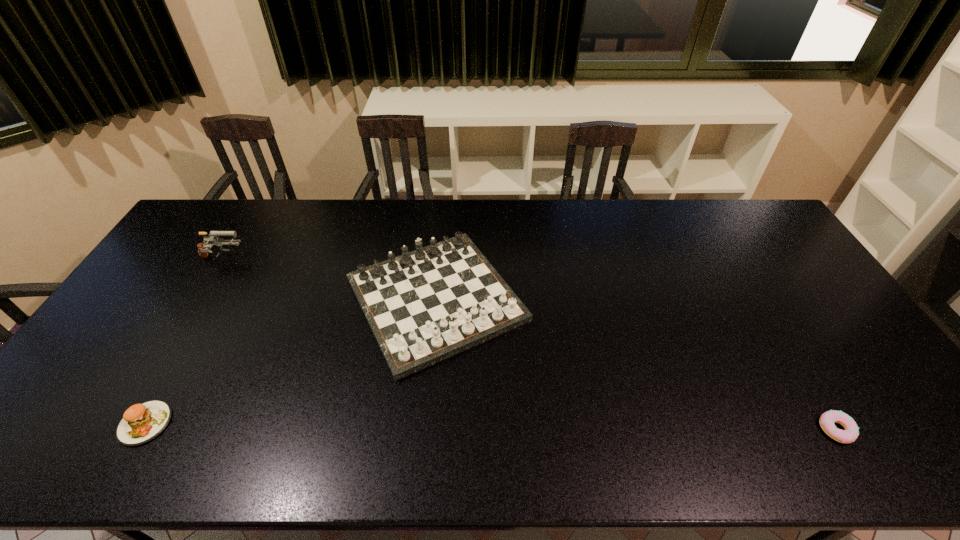
The width and height of the screenshot is (960, 540). What are the coordinates of `vacant space in between the doughnut and the gun` in the screenshot? It's located at (529, 345).

This screenshot has height=540, width=960. I want to click on vacant area that lies between the second object from right to left and the gun, so (x=329, y=279).

Locate an element on the screen. free spot between the patty and the gun is located at coordinates point(184,341).

Where is `vacant area that lies between the chessboard and the gun`? Image resolution: width=960 pixels, height=540 pixels. vacant area that lies between the chessboard and the gun is located at coordinates (329, 279).

Image resolution: width=960 pixels, height=540 pixels. What are the coordinates of `free space between the second shortest object and the chessboard` in the screenshot? It's located at (291, 361).

Locate an element on the screen. free space between the chessboard and the patty is located at coordinates (x=291, y=361).

Locate an element on the screen. vacant area that lies between the gun and the doughnut is located at coordinates (529, 345).

Locate an element on the screen. blank region between the gun and the third object from left to right is located at coordinates (329, 279).

You are a GUI agent. You are given a task and a screenshot of the screen. Output one action in this format:
    pyautogui.click(x=<x>, y=<y>)
    Task: Click on the object that is the second nearest to the gun
    
    Given the screenshot: What is the action you would take?
    141,423

Choose which object is the nearest neighbor to the rightmost object. Please provide its 2D coordinates. Your answer should be formatted as a tuple, i.e. [(x, y)], where the tuple contains the x and y coordinates of a point satisfying the conditions above.

[(424, 306)]